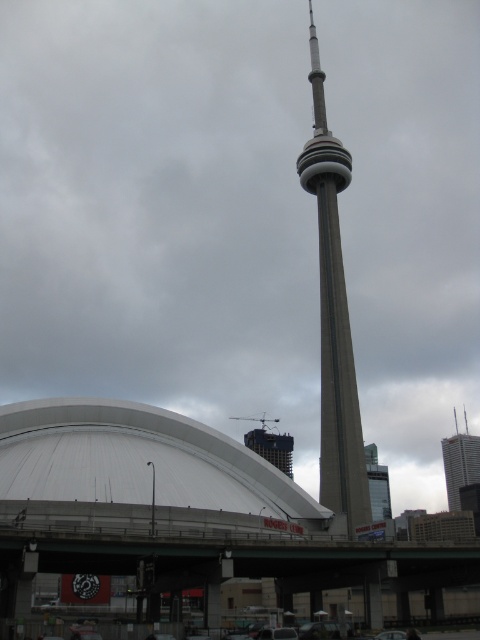
You are standing at the base of the CN Tower and looking up. There is a point marked at coordinates (x=334, y=317). Based on the description, where is this point located?

The point marked at coordinates (x=334, y=317) is located on the concrete tower at center.

You are a tourist standing at the base of the CN Tower and want to take a photo that includes both the concrete tower at center and the gray concrete skyscraper at right. Which object should you position closer to the center of your camera frame to ensure both are fully visible?

You should position the concrete tower at center closer to the center of your camera frame because it is bigger than the gray concrete skyscraper at right, allowing both to fit within the frame when the larger object is centrally placed.